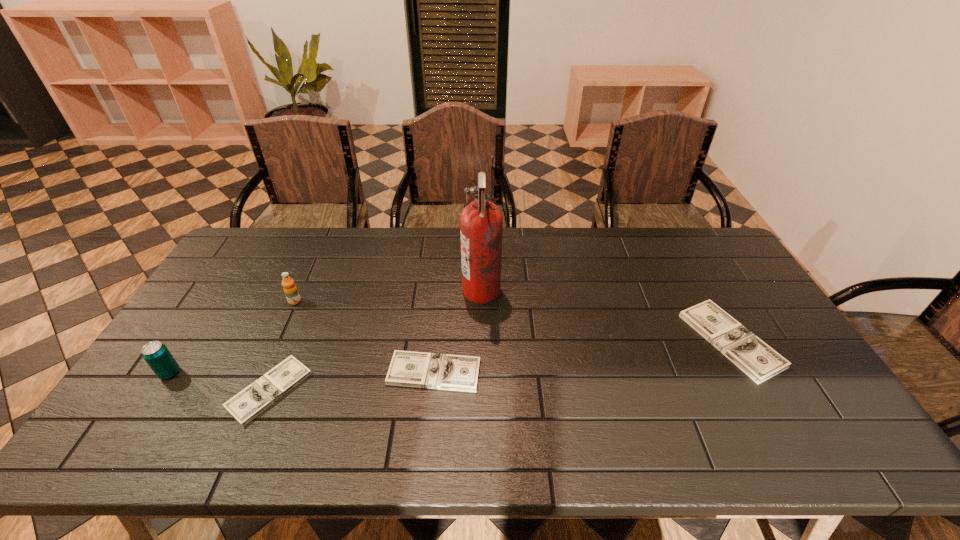
Where is `vacant space that's between the shortest dollar and the beer can`? The width and height of the screenshot is (960, 540). vacant space that's between the shortest dollar and the beer can is located at coordinates (220, 382).

Find the location of `object that is the fourth closest to the orange juice`. object that is the fourth closest to the orange juice is located at coordinates (481, 223).

The image size is (960, 540). What are the coordinates of `object that is the second closest to the fire extinguisher` in the screenshot? It's located at (246, 405).

Choose which dollar is the third nearest neighbor to the orange juice. Please provide its 2D coordinates. Your answer should be formatted as a tuple, i.e. [(x, y)], where the tuple contains the x and y coordinates of a point satisfying the conditions above.

[(759, 361)]

The image size is (960, 540). I want to click on dollar that stands as the third closest to the leftmost object, so click(759, 361).

Where is `free space that satisfies the following two spatial constraints: 1. on the front of the rightmost object near the operation label; 2. on the left side of the fire extinguisher`? free space that satisfies the following two spatial constraints: 1. on the front of the rightmost object near the operation label; 2. on the left side of the fire extinguisher is located at coordinates (482, 340).

You are a GUI agent. You are given a task and a screenshot of the screen. Output one action in this format:
    pyautogui.click(x=<x>, y=<y>)
    Task: Click on the blank area in the image that satisfies the following two spatial constraints: 1. on the label of the orange juice; 2. on the right side of the rightmost dollar
    The height and width of the screenshot is (540, 960).
    Given the screenshot: What is the action you would take?
    pyautogui.click(x=277, y=340)

The image size is (960, 540). What are the coordinates of `free region that satisfies the following two spatial constraints: 1. on the back side of the shortest object; 2. on the right side of the rightmost object` in the screenshot? It's located at (291, 340).

At what (x,y) coordinates should I click in order to perform the action: click on free spot that satisfies the following two spatial constraints: 1. on the label of the leftmost dollar; 2. on the left side of the orange juice. Please return your answer as a coordinate pair (x, y). This screenshot has width=960, height=540. Looking at the image, I should click on (254, 390).

Image resolution: width=960 pixels, height=540 pixels. In order to click on free space in the image that satisfies the following two spatial constraints: 1. on the back side of the second shortest object; 2. on the right side of the leftmost object in this screenshot , I will do `click(170, 373)`.